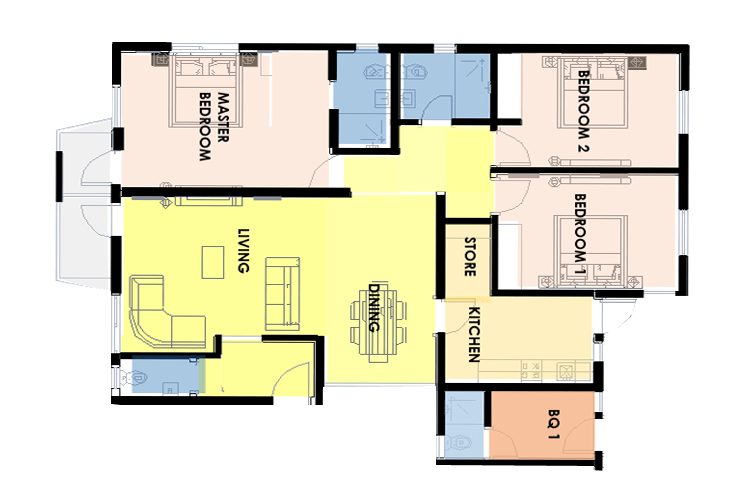
The width and height of the screenshot is (750, 500). I want to click on bath, so click(356, 121).